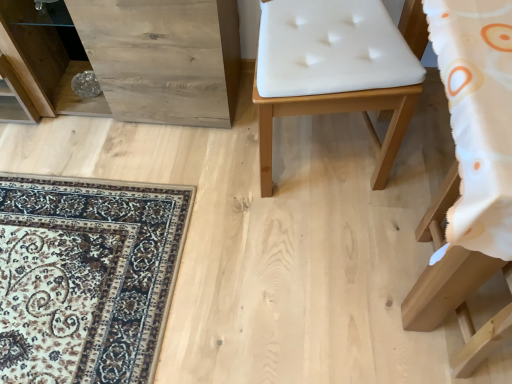
Question: Should I look upward or downward to see white fabric cushion at lower right, which appears as the second furniture when viewed from the left?

Choices:
 (A) up
 (B) down

Answer: (B)

Question: Considering the relative sizes of white fabric cushion at lower right, which is the first furniture in right-to-left order, and white leather chair at center, which is the 2th furniture from bottom to top, in the image provided, is white fabric cushion at lower right, which is the first furniture in right-to-left order, bigger than white leather chair at center, which is the 2th furniture from bottom to top,?

Choices:
 (A) yes
 (B) no

Answer: (B)

Question: From a real-world perspective, is white fabric cushion at lower right, acting as the second furniture starting from the top, positioned under white leather chair at center, acting as the 2th furniture starting from the right, based on gravity?

Choices:
 (A) yes
 (B) no

Answer: (A)

Question: From the image's perspective, is white fabric cushion at lower right, which appears as the second furniture when viewed from the left, over white leather chair at center, which is counted as the first furniture, starting from the top?

Choices:
 (A) no
 (B) yes

Answer: (A)

Question: Can you confirm if white fabric cushion at lower right, which is the first furniture in right-to-left order, is wider than white leather chair at center, which is the 2th furniture from bottom to top?

Choices:
 (A) yes
 (B) no

Answer: (A)

Question: Can you see white fabric cushion at lower right, which is the first furniture in right-to-left order, touching white leather chair at center, which is the 2th furniture from bottom to top?

Choices:
 (A) yes
 (B) no

Answer: (B)

Question: Are white fabric cushion at lower right, which is the first furniture in right-to-left order, and white leather chair at center, marked as the first furniture in a left-to-right arrangement, far apart?

Choices:
 (A) no
 (B) yes

Answer: (A)

Question: Considering the relative sizes of white leather chair at center, which is counted as the first furniture, starting from the top, and natural wood dresser at left in the image provided, is white leather chair at center, which is counted as the first furniture, starting from the top, thinner than natural wood dresser at left?

Choices:
 (A) yes
 (B) no

Answer: (B)

Question: Is natural wood dresser at left surrounded by white leather chair at center, which is counted as the first furniture, starting from the top?

Choices:
 (A) yes
 (B) no

Answer: (B)

Question: Is white leather chair at center, which is the 2th furniture from bottom to top, to the left of natural wood dresser at left from the viewer's perspective?

Choices:
 (A) no
 (B) yes

Answer: (A)

Question: Is the position of white leather chair at center, which is the 2th furniture from bottom to top, less distant than that of natural wood dresser at left?

Choices:
 (A) yes
 (B) no

Answer: (A)

Question: Is white leather chair at center, which is counted as the first furniture, starting from the top, not within natural wood dresser at left?

Choices:
 (A) yes
 (B) no

Answer: (A)

Question: Considering the relative positions of white leather chair at center, which is counted as the first furniture, starting from the top, and natural wood dresser at left in the image provided, is white leather chair at center, which is counted as the first furniture, starting from the top, to the right of natural wood dresser at left from the viewer's perspective?

Choices:
 (A) no
 (B) yes

Answer: (B)

Question: Is white leather chair at center, acting as the 2th furniture starting from the right, bigger than white fabric cushion at lower right, which appears as the second furniture when viewed from the left?

Choices:
 (A) yes
 (B) no

Answer: (A)